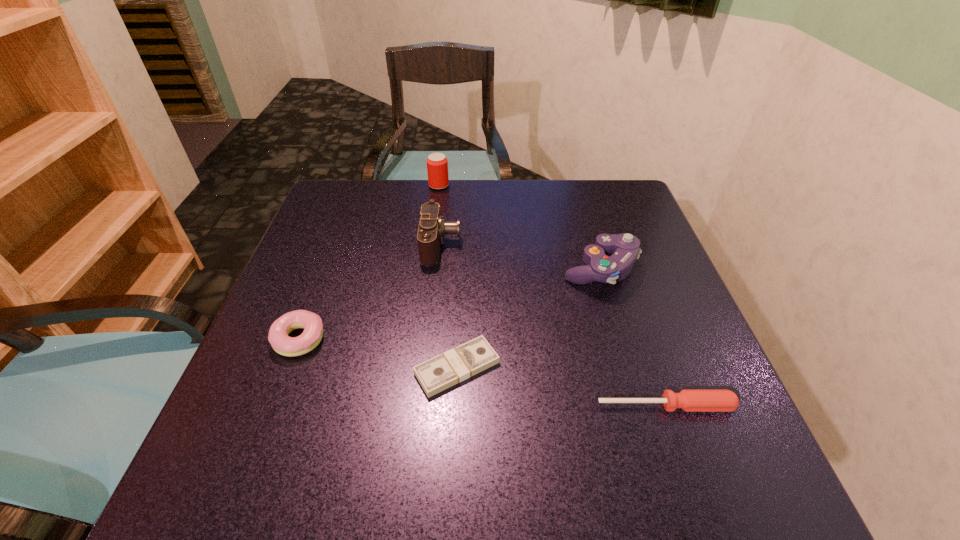
Image resolution: width=960 pixels, height=540 pixels. I want to click on vacant space located on the front of the leftmost object, so click(277, 398).

Where is `vacant space situated 0.170m on the back of the second shortest object`? This screenshot has width=960, height=540. vacant space situated 0.170m on the back of the second shortest object is located at coordinates (637, 323).

The image size is (960, 540). I want to click on vacant region located 0.060m on the front of the dollar, so click(454, 430).

Locate an element on the screen. The image size is (960, 540). beer can that is at the far edge is located at coordinates (437, 164).

Where is `camera present at the far edge`? camera present at the far edge is located at coordinates (432, 228).

At what (x,y) coordinates should I click in order to perform the action: click on object that is at the left edge. Please return your answer as a coordinate pair (x, y). The image size is (960, 540). Looking at the image, I should click on (278, 337).

The image size is (960, 540). What are the coordinates of `control that is at the right edge` in the screenshot? It's located at (624, 247).

Locate an element on the screen. The width and height of the screenshot is (960, 540). screwdriver that is positioned at the right edge is located at coordinates (688, 400).

Identify the location of vacant space at the far edge of the desktop. (450, 192).

In order to click on free space at the near edge of the desktop in this screenshot , I will do `click(336, 459)`.